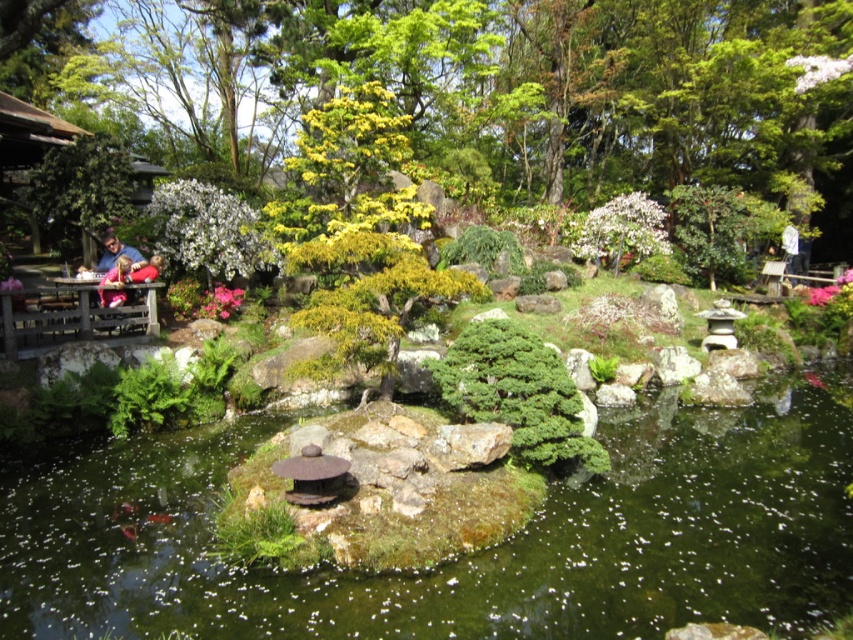
You are a photographer standing at the edge of the pond in the Japanese garden. You want to take a photo of both the point at coordinates point [207,307] and point [787,236]. Which point will appear larger in your photo?

Point [207,307] is closer to the camera than point [787,236], so it will appear larger in the photo.

You are standing in the Japanese garden and want to take a photo of the white fluffy cloud at upper right and the matte red shirt at left. If your camera has a maximum zoom range of 50 feet, can you capture both objects in a single frame without moving?

The distance between the white fluffy cloud at upper right and the matte red shirt at left is 52.67 feet, which exceeds the camera maximum zoom range of 50 feet. Therefore, you cannot capture both in a single frame without moving.

You are a gardener who needs to water the pink matte flower at upper right and the green liquid water at center. Which object requires more water? Please explain your reasoning based on their positions and the scene description.

The pink matte flower at upper right requires more water because it is taller than the green liquid water at center, suggesting it may need more hydration to maintain its height and vibrancy in the garden.